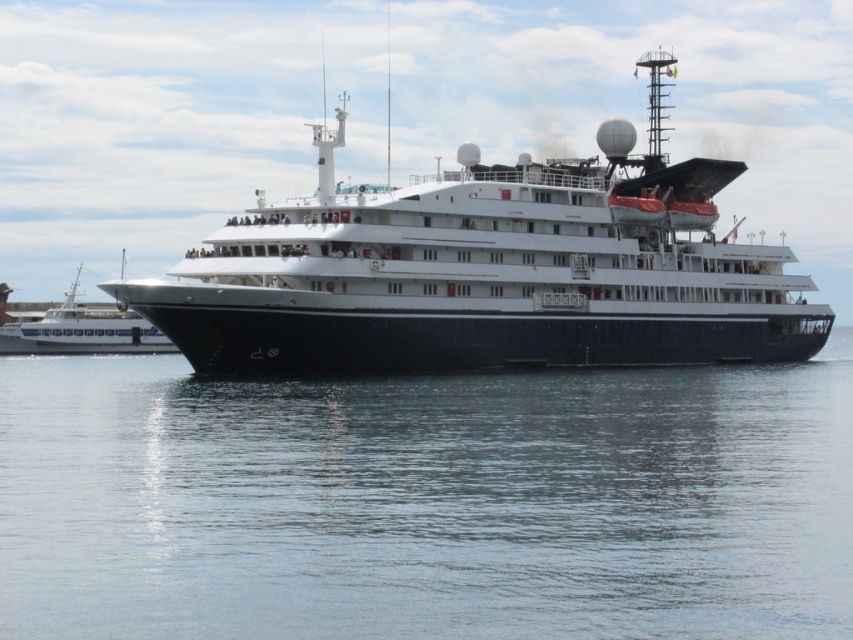
Between transparent water at center and white glossy boat at left, which one has more height?

white glossy boat at left

In the scene shown: Who is shorter, transparent water at center or white glossy boat at left?

With less height is transparent water at center.

Who is more forward, (126, 502) or (61, 326)?

Point (126, 502) is in front.

Where is `transparent water at center`? transparent water at center is located at coordinates (426, 502).

Who is lower down, black glossy ship at center or white glossy boat at left?

white glossy boat at left is below.

Who is higher up, black glossy ship at center or white glossy boat at left?

Positioned higher is black glossy ship at center.

Image resolution: width=853 pixels, height=640 pixels. What do you see at coordinates (488, 269) in the screenshot?
I see `black glossy ship at center` at bounding box center [488, 269].

At what (x,y) coordinates should I click in order to perform the action: click on black glossy ship at center. Please return your answer as a coordinate pair (x, y). The width and height of the screenshot is (853, 640). Looking at the image, I should click on (488, 269).

Who is more forward, (140, 390) or (387, 282)?

Point (387, 282)

Can you confirm if transparent water at center is shorter than black glossy ship at center?

Yes, transparent water at center is shorter than black glossy ship at center.

Is point (138, 593) farther from camera compared to point (790, 305)?

No.

Identify the location of transparent water at center. (426, 502).